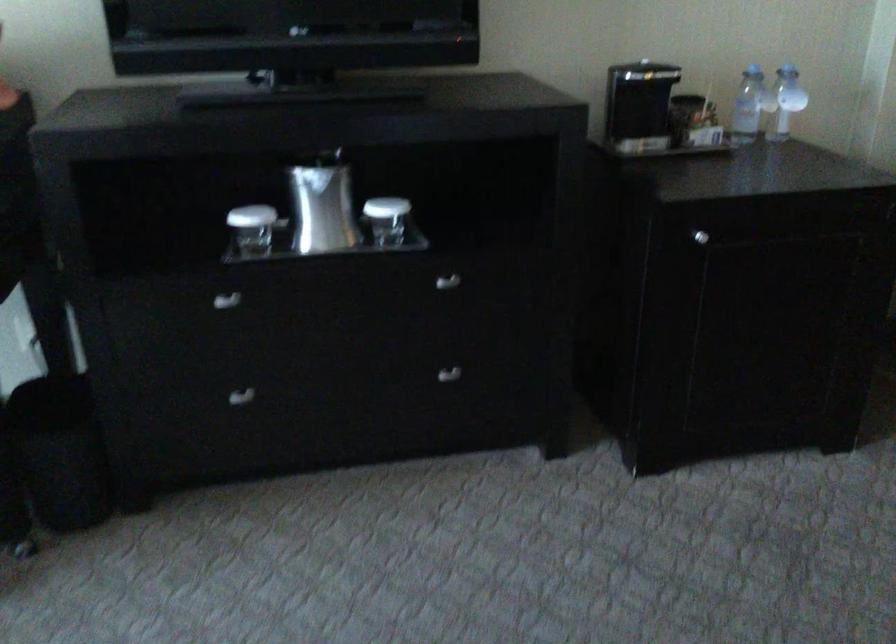
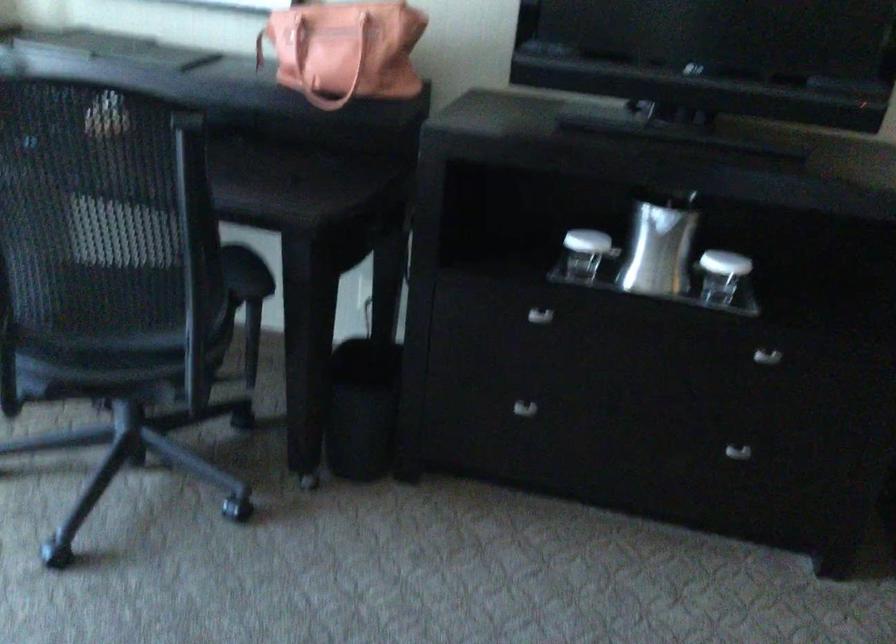
The point at (319, 202) is marked in the first image. Where is the corresponding point in the second image?

(659, 245)